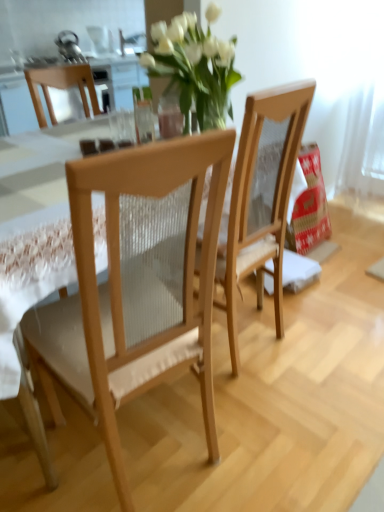
Identify the location of vacant space to the right of light wood mesh chair at center, the first chair viewed from the left. Image resolution: width=384 pixels, height=512 pixels. (275, 429).